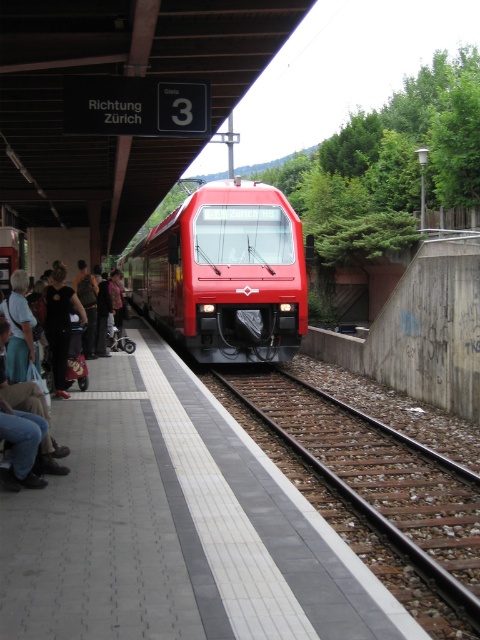
Question: Which object appears farthest from the camera in this image?

Choices:
 (A) rusty metal track at center
 (B) black fabric bag at left
 (C) dark gray fabric jacket at left
 (D) shiny red train at center

Answer: (D)

Question: Which of the following is the farthest from the observer?

Choices:
 (A) rusty metal track at center
 (B) black fabric bag at left

Answer: (B)

Question: In this image, where is shiny red train at center located relative to dark gray fabric jacket at left?

Choices:
 (A) above
 (B) below

Answer: (A)

Question: Does rusty metal track at center appear under black fabric bag at left?

Choices:
 (A) yes
 (B) no

Answer: (A)

Question: Does black fabric bag at left lie in front of dark gray fabric jacket at left?

Choices:
 (A) no
 (B) yes

Answer: (A)

Question: Estimate the real-world distances between objects in this image. Which object is closer to the black fabric bag at left?

Choices:
 (A) shiny red train at center
 (B) rusty metal track at center
 (C) dark gray fabric jacket at left

Answer: (C)